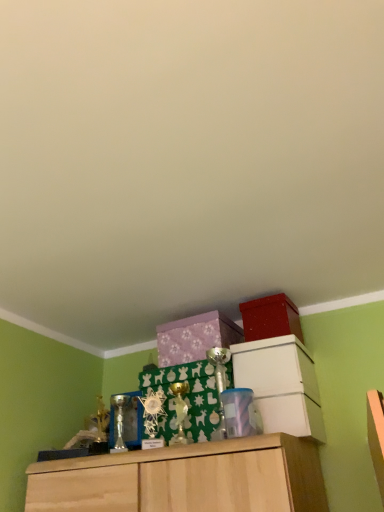
Question: Is the position of white matte cabinet at upper center, the 2th cabinetry viewed from the left, less distant than that of translucent plastic container at center?

Choices:
 (A) yes
 (B) no

Answer: (B)

Question: Can you confirm if white matte cabinet at upper center, the first cabinetry in the right-to-left sequence, is wider than translucent plastic container at center?

Choices:
 (A) no
 (B) yes

Answer: (B)

Question: Considering the relative sizes of white matte cabinet at upper center, the first cabinetry in the right-to-left sequence, and translucent plastic container at center in the image provided, is white matte cabinet at upper center, the first cabinetry in the right-to-left sequence, shorter than translucent plastic container at center?

Choices:
 (A) yes
 (B) no

Answer: (B)

Question: From the image's perspective, is white matte cabinet at upper center, the first cabinetry in the right-to-left sequence, below translucent plastic container at center?

Choices:
 (A) no
 (B) yes

Answer: (A)

Question: Considering the relative sizes of white matte cabinet at upper center, the 2th cabinetry viewed from the left, and translucent plastic container at center in the image provided, is white matte cabinet at upper center, the 2th cabinetry viewed from the left, bigger than translucent plastic container at center?

Choices:
 (A) no
 (B) yes

Answer: (B)

Question: From a real-world perspective, is matte red storage box at upper right positioned above or below white matte cabinet at upper center, the 2th cabinetry viewed from the left?

Choices:
 (A) above
 (B) below

Answer: (A)

Question: Based on their positions, is matte red storage box at upper right located to the left or right of white matte cabinet at upper center, the first cabinetry in the right-to-left sequence?

Choices:
 (A) left
 (B) right

Answer: (B)

Question: Is point (299, 334) closer or farther from the camera than point (266, 418)?

Choices:
 (A) closer
 (B) farther

Answer: (B)

Question: In the image, is matte red storage box at upper right positioned in front of or behind white matte cabinet at upper center, the 2th cabinetry viewed from the left?

Choices:
 (A) front
 (B) behind

Answer: (B)

Question: From a real-world perspective, is purple matte box at center, positioned as the second cabinetry in right-to-left order, physically located above or below translucent plastic container at center?

Choices:
 (A) above
 (B) below

Answer: (A)

Question: Looking at the image, does purple matte box at center, the 1th cabinetry in the left-to-right sequence, seem bigger or smaller compared to translucent plastic container at center?

Choices:
 (A) small
 (B) big

Answer: (B)

Question: From the image's perspective, is purple matte box at center, the 1th cabinetry in the left-to-right sequence, above or below translucent plastic container at center?

Choices:
 (A) below
 (B) above

Answer: (B)

Question: Is purple matte box at center, the 1th cabinetry in the left-to-right sequence, inside the boundaries of translucent plastic container at center, or outside?

Choices:
 (A) inside
 (B) outside

Answer: (B)

Question: Visually, is matte red storage box at upper right positioned to the left or to the right of purple matte box at center, positioned as the second cabinetry in right-to-left order?

Choices:
 (A) right
 (B) left

Answer: (A)

Question: Looking at the image, does matte red storage box at upper right seem bigger or smaller compared to purple matte box at center, the 1th cabinetry in the left-to-right sequence?

Choices:
 (A) small
 (B) big

Answer: (A)